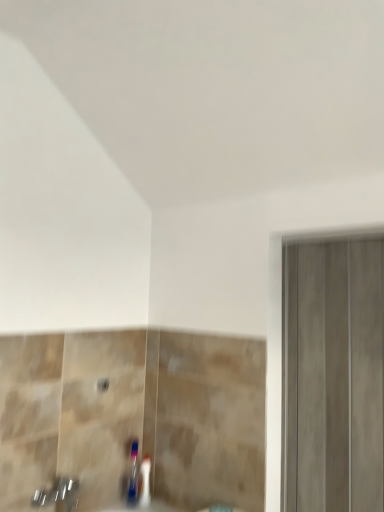
What do you see at coordinates (334, 376) in the screenshot? Image resolution: width=384 pixels, height=512 pixels. I see `matte gray barn door at right` at bounding box center [334, 376].

Measure the distance between point (337, 506) and camera.

The distance of point (337, 506) from camera is 1.54 meters.

Find the location of `matte gray barn door at right`. matte gray barn door at right is located at coordinates (334, 376).

Identify the location of matte gray barn door at right. (334, 376).